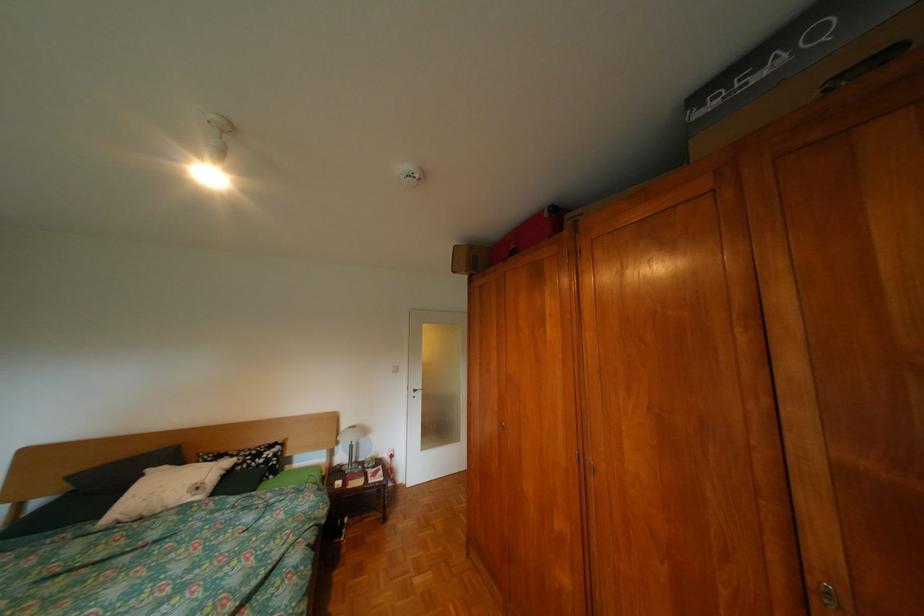
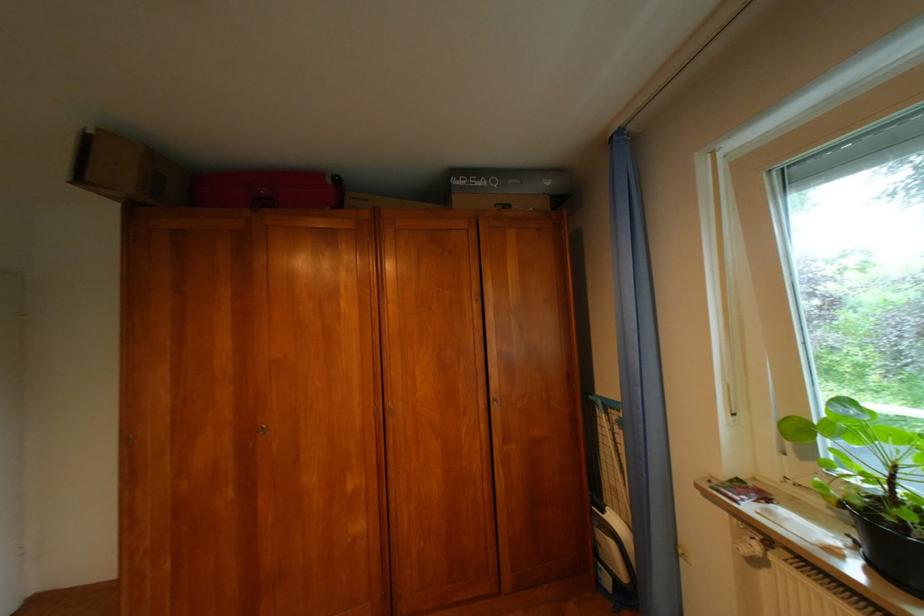
Question: Based on the continuous images, in which direction is the camera rotating? Reply with the corresponding letter.

Choices:
 (A) Left
 (B) Right
 (C) Up
 (D) Down

Answer: (B)